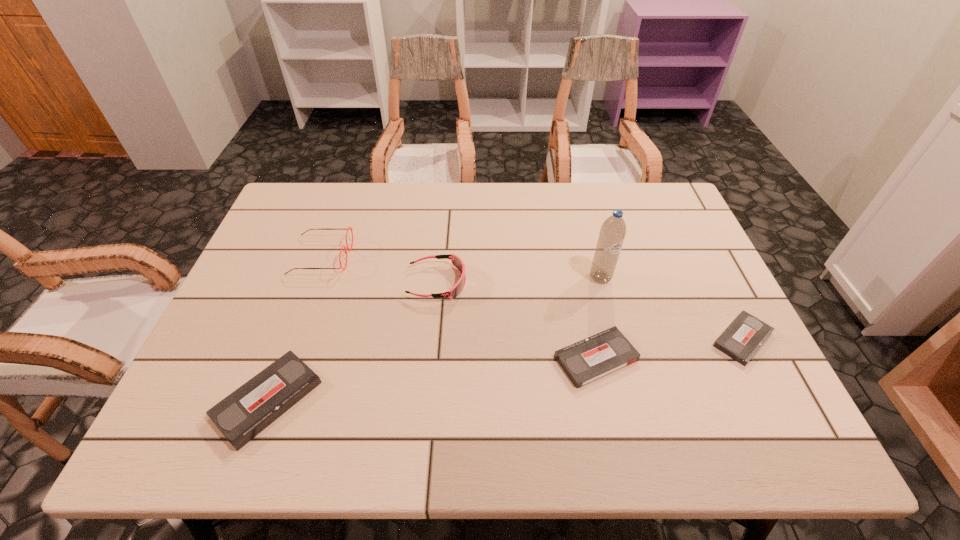
At what (x,y) coordinates should I click in order to perform the action: click on free space at the near edge of the desktop. Please return your answer as a coordinate pair (x, y). Image resolution: width=960 pixels, height=540 pixels. Looking at the image, I should click on (326, 398).

Locate an element on the screen. free space at the left edge is located at coordinates (294, 245).

In the image, there is a desktop. Where is `vacant space at the right edge`? vacant space at the right edge is located at coordinates (693, 313).

Locate an element on the screen. free space at the far left corner of the desktop is located at coordinates (306, 213).

In the image, there is a desktop. Identify the location of free space at the near left corner. (205, 401).

In the image, there is a desktop. Find the location of `free space at the far right corner`. free space at the far right corner is located at coordinates (649, 218).

At what (x,y) coordinates should I click in order to perform the action: click on vacant region at the near right corner of the desktop. Please return your answer as a coordinate pair (x, y). Looking at the image, I should click on (769, 396).

Find the location of `blank region between the shortest object and the fifth shortest object`. blank region between the shortest object and the fifth shortest object is located at coordinates (532, 298).

Where is `blank region between the fifth shortest object and the leftmost videotape`? The image size is (960, 540). blank region between the fifth shortest object and the leftmost videotape is located at coordinates (295, 328).

This screenshot has height=540, width=960. What are the coordinates of `free space between the water bottle and the fifth tallest object` in the screenshot? It's located at (598, 318).